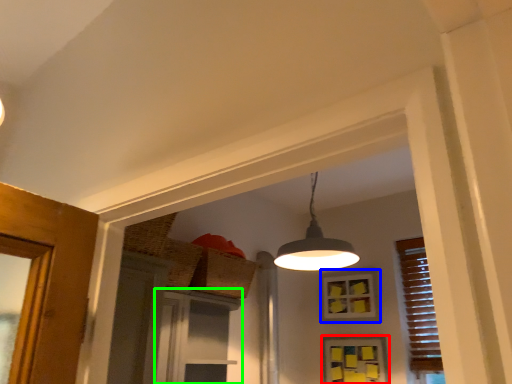
Question: Considering the real-world distances, which object is closest to window (highlighted by a red box)? window (highlighted by a blue box) or screen door (highlighted by a green box).

Choices:
 (A) window
 (B) screen door

Answer: (A)